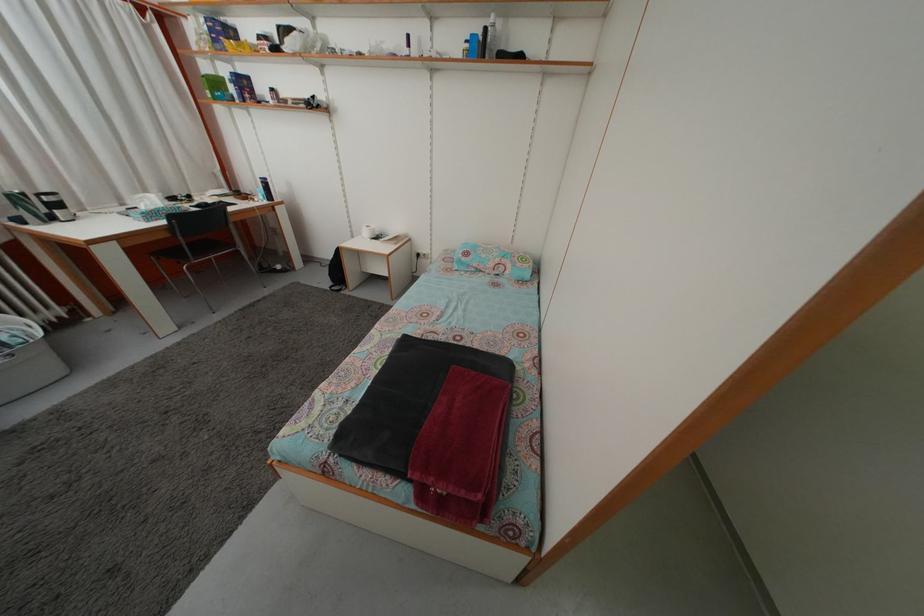
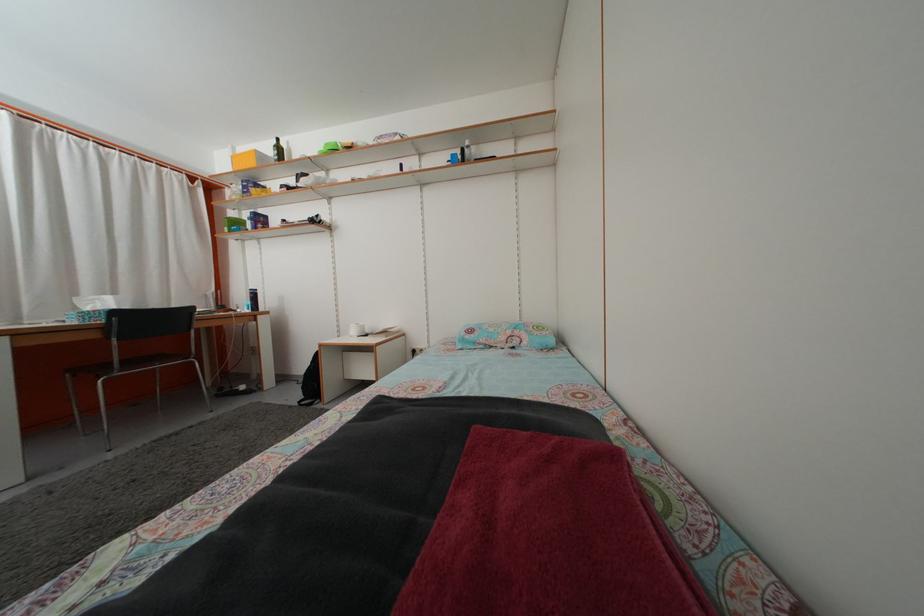
In the second image, find the point that corresponds to pixel 211 75 in the first image.

(237, 223)